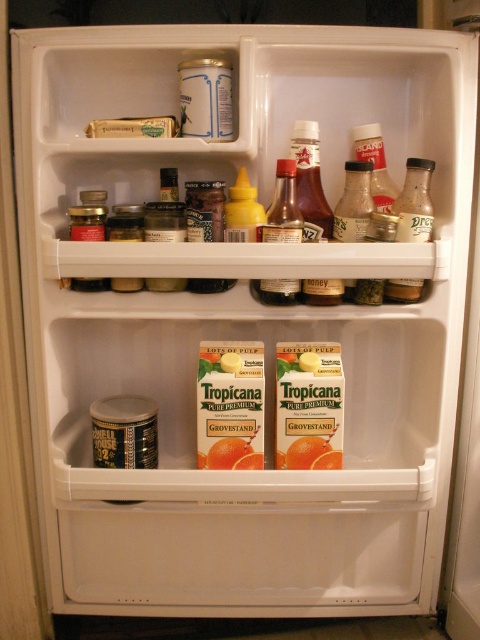
What do you see at coordinates (283, 208) in the screenshot? I see `translucent plastic bottle at center` at bounding box center [283, 208].

Can you confirm if translucent plastic bottle at center is positioned to the left of orange matte carton at upper center?

Incorrect, translucent plastic bottle at center is not on the left side of orange matte carton at upper center.

Does point (276, 236) come farther from viewer compared to point (252, 232)?

No, (276, 236) is in front of (252, 232).

I want to click on translucent plastic bottle at center, so click(x=283, y=208).

Between translucent plastic bottle at upper right and orange matte carton at upper center, which one is positioned lower?

translucent plastic bottle at upper right

Does translucent plastic bottle at upper right appear under orange matte carton at upper center?

Yes, translucent plastic bottle at upper right is below orange matte carton at upper center.

Image resolution: width=480 pixels, height=640 pixels. Describe the element at coordinates (415, 202) in the screenshot. I see `translucent plastic bottle at upper right` at that location.

Where is `translucent plastic bottle at upper right`? This screenshot has height=640, width=480. translucent plastic bottle at upper right is located at coordinates (415, 202).

Is translucent plastic bottle at upper right further to the viewer compared to translucent plastic bottle at center?

Yes, translucent plastic bottle at upper right is further from the viewer.

Does translucent plastic bottle at upper right appear on the left side of translucent plastic bottle at center?

No, translucent plastic bottle at upper right is not to the left of translucent plastic bottle at center.

From the picture: Measure the distance between point (396, 198) and camera.

A distance of 34.61 inches exists between point (396, 198) and camera.

At what (x,y) coordinates should I click in order to perform the action: click on translucent plastic bottle at upper right. Please return your answer as a coordinate pair (x, y). This screenshot has width=480, height=640. Looking at the image, I should click on (415, 202).